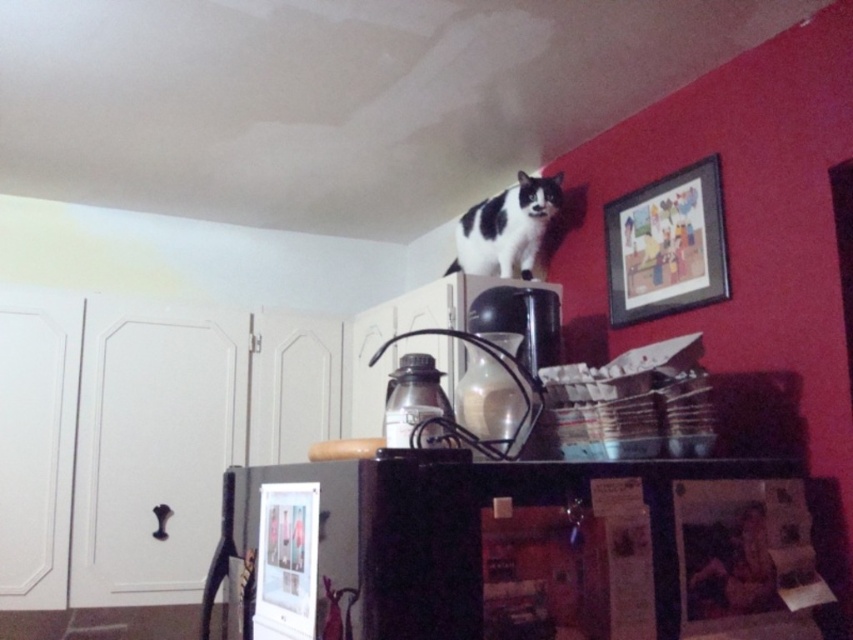
The height and width of the screenshot is (640, 853). Describe the element at coordinates (666, 244) in the screenshot. I see `wooden framed artwork at upper right` at that location.

Which is behind, point (656, 243) or point (521, 195)?

The point (521, 195) is more distant.

Where is `wooden framed artwork at upper right`? wooden framed artwork at upper right is located at coordinates (666, 244).